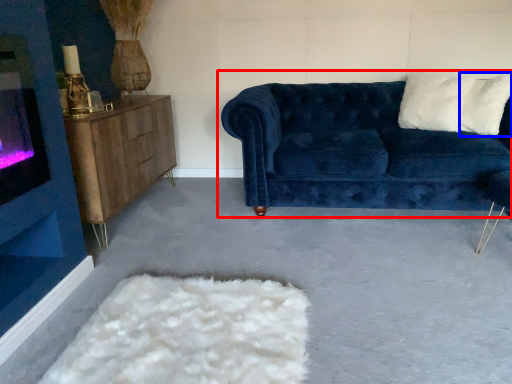
Question: Which point is further to the camera, studio couch (highlighted by a red box) or pillow (highlighted by a blue box)?

Choices:
 (A) studio couch
 (B) pillow

Answer: (B)